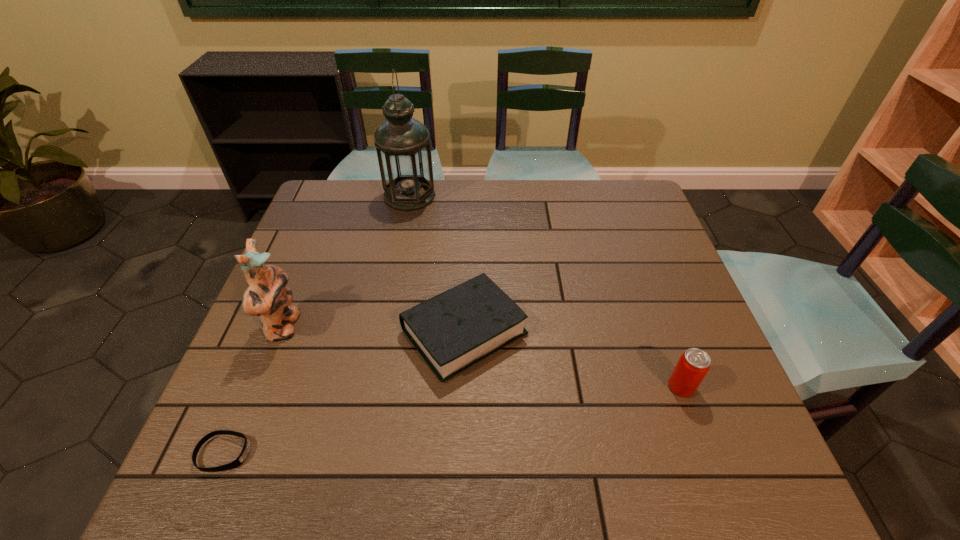
Where is `free region located 0.300m on the back of the can`? free region located 0.300m on the back of the can is located at coordinates (641, 278).

Find the location of a particular element. blank space located on the front of the Bible is located at coordinates (462, 415).

Where is `vacant point located 0.240m on the display of the wristband`? This screenshot has height=540, width=960. vacant point located 0.240m on the display of the wristband is located at coordinates (377, 453).

At what (x,y) coordinates should I click in order to perform the action: click on object that is at the far edge. Please return your answer as a coordinate pair (x, y). The width and height of the screenshot is (960, 540). Looking at the image, I should click on (402, 143).

The width and height of the screenshot is (960, 540). I want to click on object at the near edge, so 237,462.

Identify the location of figurine at the left edge. tap(267, 297).

Identify the location of wristband that is positioned at the left edge. (237, 462).

The height and width of the screenshot is (540, 960). I want to click on object present at the right edge, so click(693, 365).

I want to click on object that is at the near left corner, so click(237, 462).

Image resolution: width=960 pixels, height=540 pixels. Identify the location of free space at the far edge. (555, 223).